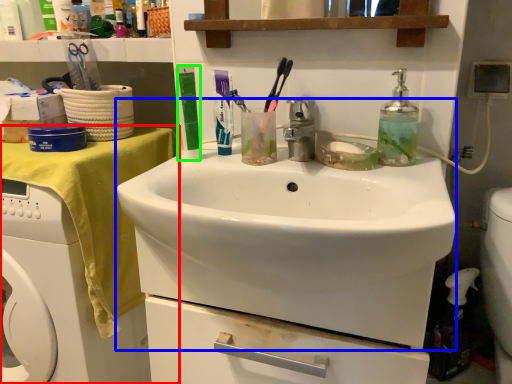
Question: Which object is the farthest from desk (highlighted by a red box)? Choose among these: sink (highlighted by a blue box) or toiletry (highlighted by a green box).

Choices:
 (A) sink
 (B) toiletry

Answer: (A)